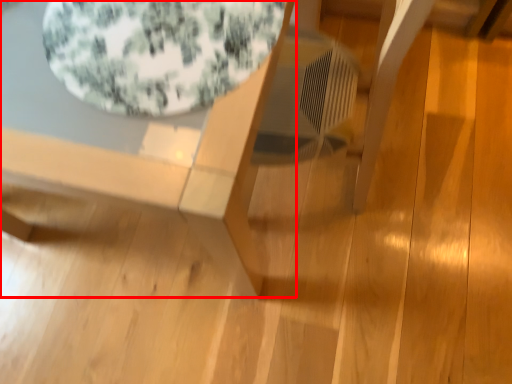
Question: From the image's perspective, what is the correct spatial relationship of table (annotated by the red box) in relation to bean bag chair?

Choices:
 (A) below
 (B) above

Answer: (A)